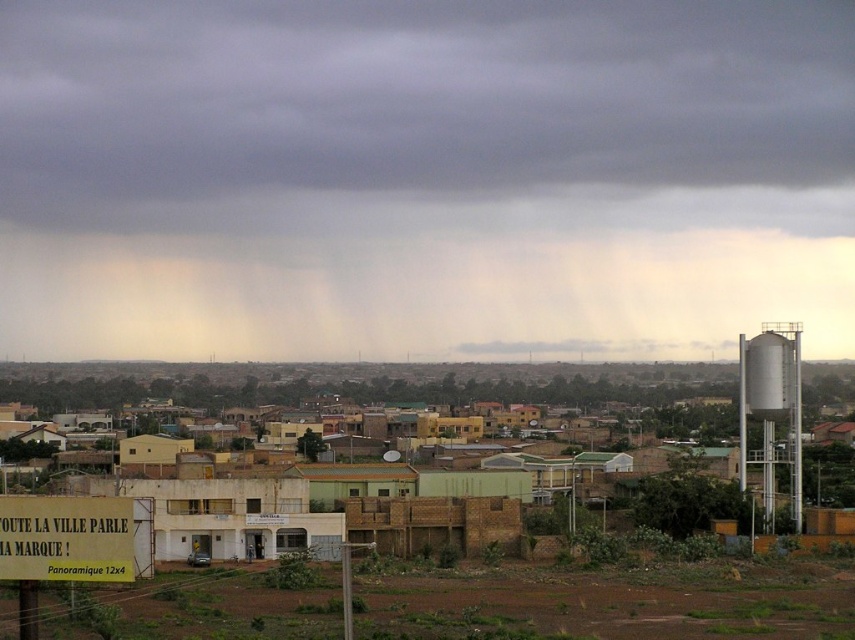
Question: Does yellow brick building at center appear on the left side of green leafy bush at lower right?

Choices:
 (A) yes
 (B) no

Answer: (A)

Question: Which point is closer to the camera?

Choices:
 (A) (385, 19)
 (B) (682, 536)
 (C) (600, 433)

Answer: (B)

Question: Which point is closer to the camera?

Choices:
 (A) green leafy bush at lower right
 (B) yellow brick building at center
 (C) dark gray cloud at upper center

Answer: (A)

Question: Can you confirm if yellow brick building at center is positioned to the right of green leafy bush at lower right?

Choices:
 (A) no
 (B) yes

Answer: (A)

Question: From the image, what is the correct spatial relationship of dark gray cloud at upper center in relation to green leafy bush at lower right?

Choices:
 (A) below
 (B) above

Answer: (B)

Question: Which of the following is the farthest from the observer?

Choices:
 (A) (661, 428)
 (B) (28, 182)
 (C) (659, 524)
 (D) (791, 333)

Answer: (B)